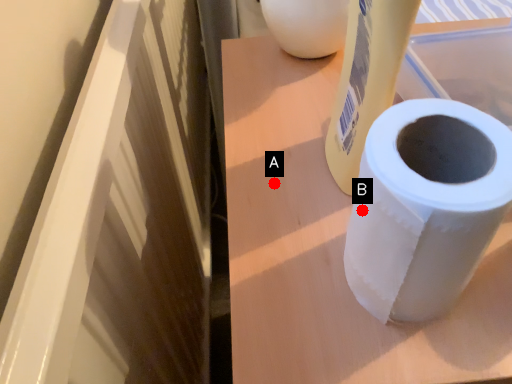
Question: Two points are circled on the image, labeled by A and B beside each circle. Which point is closer to the camera?

Choices:
 (A) A is closer
 (B) B is closer

Answer: (B)